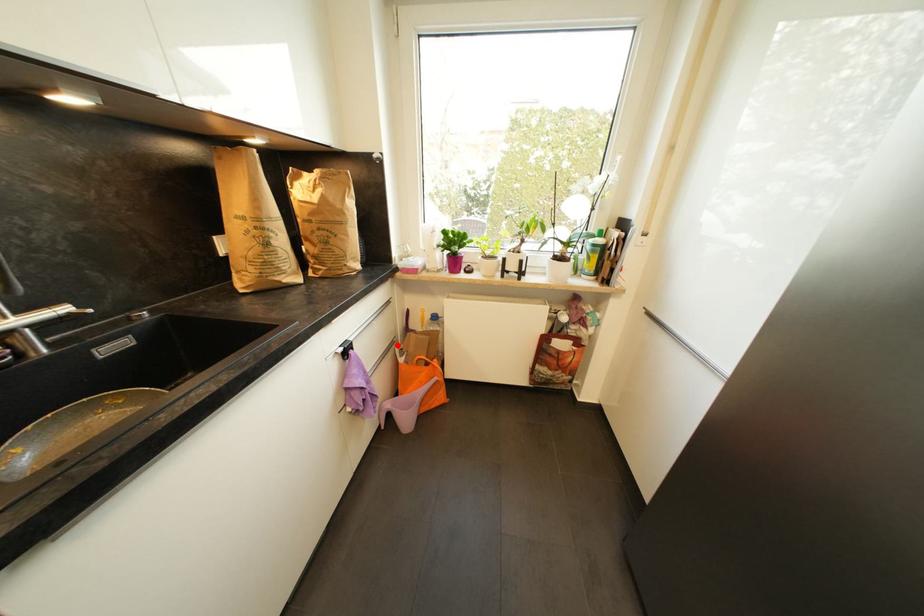
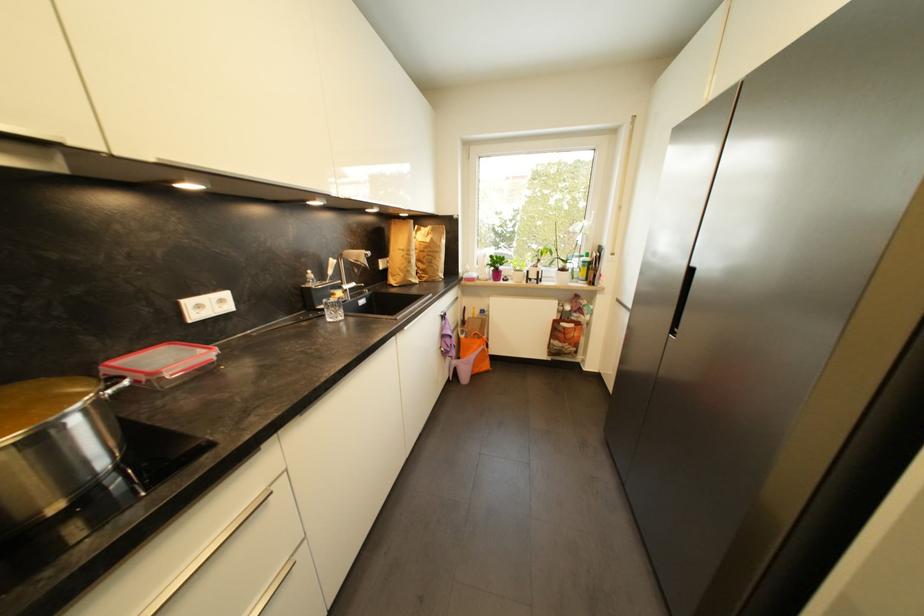
Question: A red point is marked in image1. In image2, is the corresponding 3D point closer to the camera or farther? Reply with the corresponding letter.

Choices:
 (A) The corresponding 3D point is closer.
 (B) The corresponding 3D point is farther.

Answer: (A)